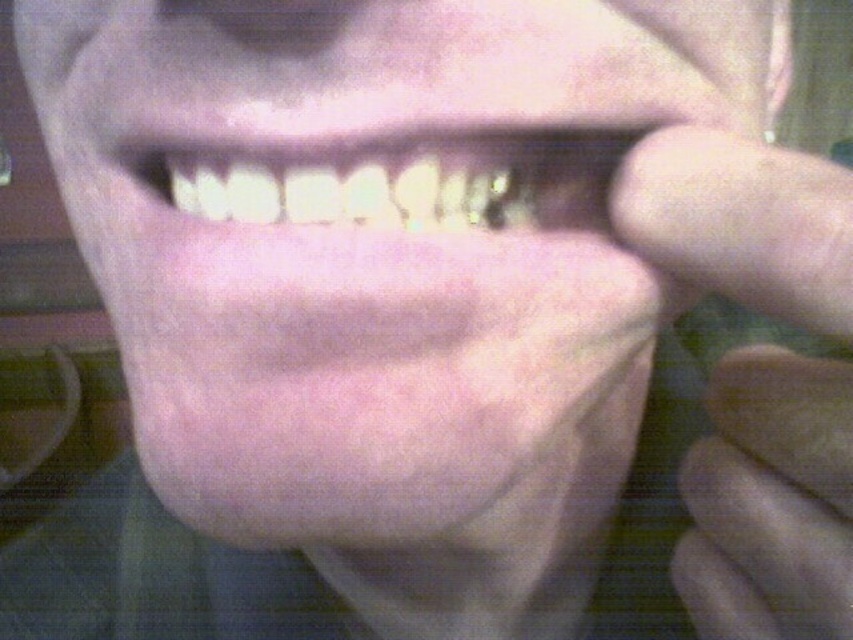
Can you confirm if smooth skin hand at right is wider than white glossy teeth at center?

No, smooth skin hand at right is not wider than white glossy teeth at center.

Can you confirm if smooth skin hand at right is positioned below white glossy teeth at center?

Indeed, smooth skin hand at right is positioned under white glossy teeth at center.

Identify the location of smooth skin hand at right. (770, 500).